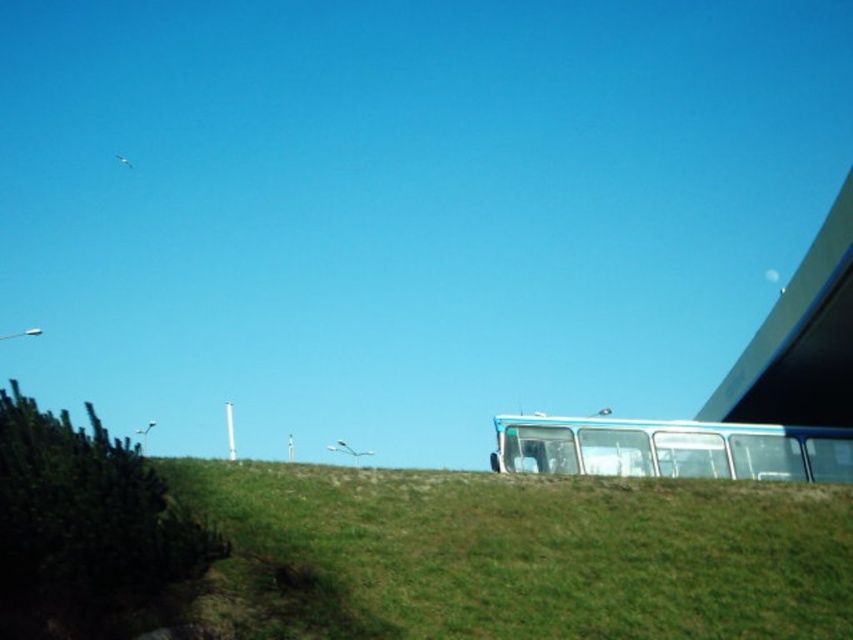
Can you confirm if green grassy hillside at center is bigger than smooth concrete overpass at upper right?

Incorrect, green grassy hillside at center is not larger than smooth concrete overpass at upper right.

This screenshot has height=640, width=853. What are the coordinates of `green grassy hillside at center` in the screenshot? It's located at (532, 552).

You are a GUI agent. You are given a task and a screenshot of the screen. Output one action in this format:
    pyautogui.click(x=<x>, y=<y>)
    Task: Click on the green grassy hillside at center
    
    Given the screenshot: What is the action you would take?
    pyautogui.click(x=532, y=552)

Where is `green grassy hillside at center`? green grassy hillside at center is located at coordinates (532, 552).

Does green grassy hillside at center come in front of blue metallic bus at right?

Yes, it is.

Which is more to the left, green grassy hillside at center or blue metallic bus at right?

green grassy hillside at center is more to the left.

Describe the element at coordinates (532, 552) in the screenshot. The image size is (853, 640). I see `green grassy hillside at center` at that location.

The height and width of the screenshot is (640, 853). In order to click on green grassy hillside at center in this screenshot , I will do `click(532, 552)`.

Which of these two, blue metallic bus at right or smooth concrete overpass at upper right, stands taller?

Standing taller between the two is smooth concrete overpass at upper right.

Does blue metallic bus at right appear on the left side of smooth concrete overpass at upper right?

Correct, you'll find blue metallic bus at right to the left of smooth concrete overpass at upper right.

This screenshot has width=853, height=640. I want to click on blue metallic bus at right, so click(x=670, y=449).